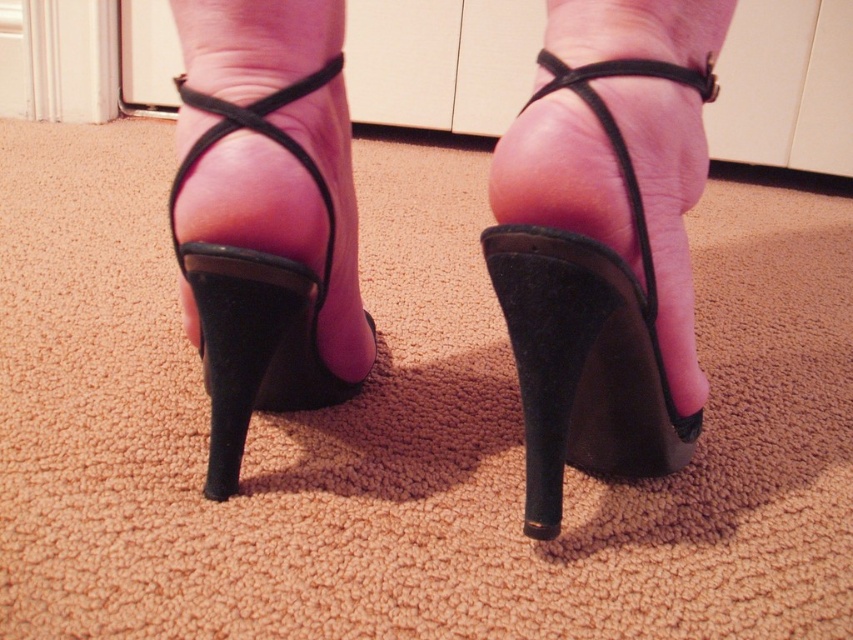
Question: Which object appears farthest from the camera in this image?

Choices:
 (A) black suede sandal at center
 (B) matte black sandal at center

Answer: (B)

Question: Which point is closer to the camera taking this photo?

Choices:
 (A) (219, 397)
 (B) (299, 280)
 (C) (524, 531)

Answer: (B)

Question: Which point is farther to the camera?

Choices:
 (A) matte black sandal at center
 (B) black suede heel at lower center
 (C) black suede sandal at center
 (D) black leather high heels at center

Answer: (B)

Question: Can you confirm if matte black sandal at center is positioned above black suede heel at lower center?

Choices:
 (A) no
 (B) yes

Answer: (B)

Question: Does black suede sandal at center have a smaller size compared to black suede heel at lower center?

Choices:
 (A) no
 (B) yes

Answer: (A)

Question: Where is matte black sandal at center located in relation to black suede heel at lower center in the image?

Choices:
 (A) above
 (B) below

Answer: (A)